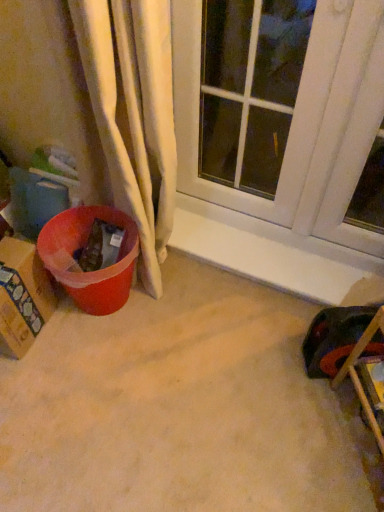
I want to click on space that is in front of cardboard box at left, so click(31, 378).